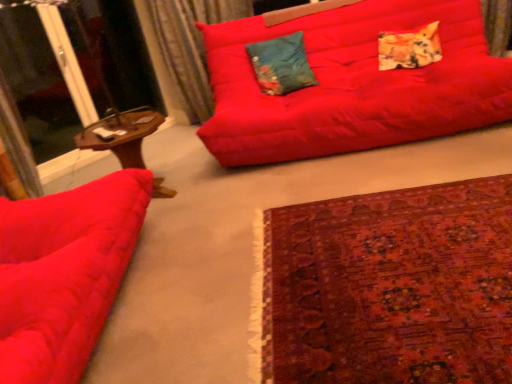
This screenshot has width=512, height=384. In order to click on free point behind woodenwoodentable at left in this screenshot , I will do `click(170, 158)`.